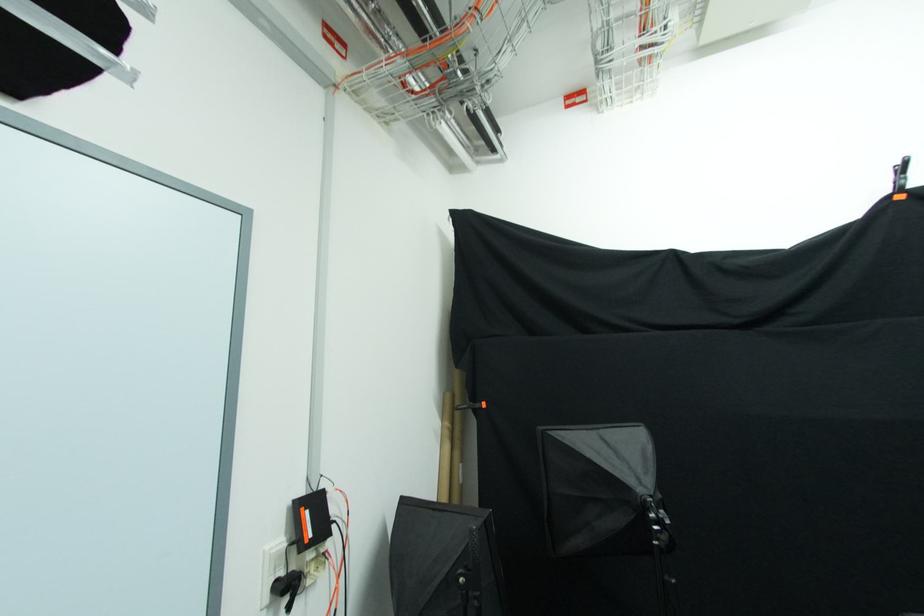
The width and height of the screenshot is (924, 616). Identify the location of black power plug. (286, 588).